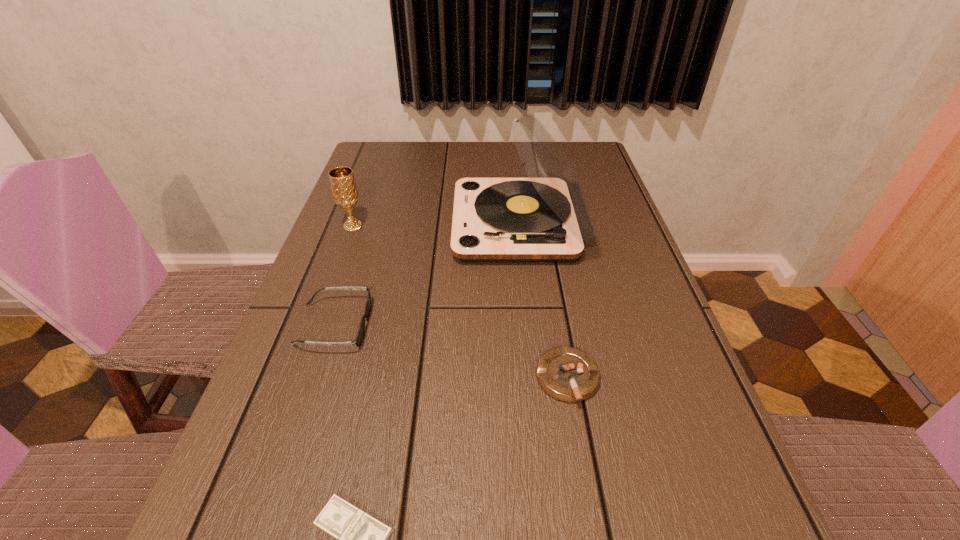
Select which object is the fourth closest to the ashtray. Please provide its 2D coordinates. Your answer should be formatted as a tuple, i.e. [(x, y)], where the tuple contains the x and y coordinates of a point satisfying the conditions above.

[(345, 194)]

Where is `vacant space that satisfies the following two spatial constraints: 1. on the front-facing side of the third shortest object; 2. on the right side of the ashtray`? The height and width of the screenshot is (540, 960). vacant space that satisfies the following two spatial constraints: 1. on the front-facing side of the third shortest object; 2. on the right side of the ashtray is located at coordinates (316, 379).

This screenshot has height=540, width=960. Identify the location of blank space that satisfies the following two spatial constraints: 1. on the back side of the second shortest object; 2. with the tonearm facing the front of the record player. pyautogui.click(x=540, y=224).

At what (x,y) coordinates should I click in order to perform the action: click on free space that satisfies the following two spatial constraints: 1. on the front-facing side of the third tallest object; 2. on the right side of the fourth tallest object. Please return your answer as a coordinate pair (x, y). Looking at the image, I should click on (316, 379).

Find the location of a particular element. vacant space that satisfies the following two spatial constraints: 1. with the tonearm facing the front of the tallest object; 2. on the back side of the ashtray is located at coordinates (536, 379).